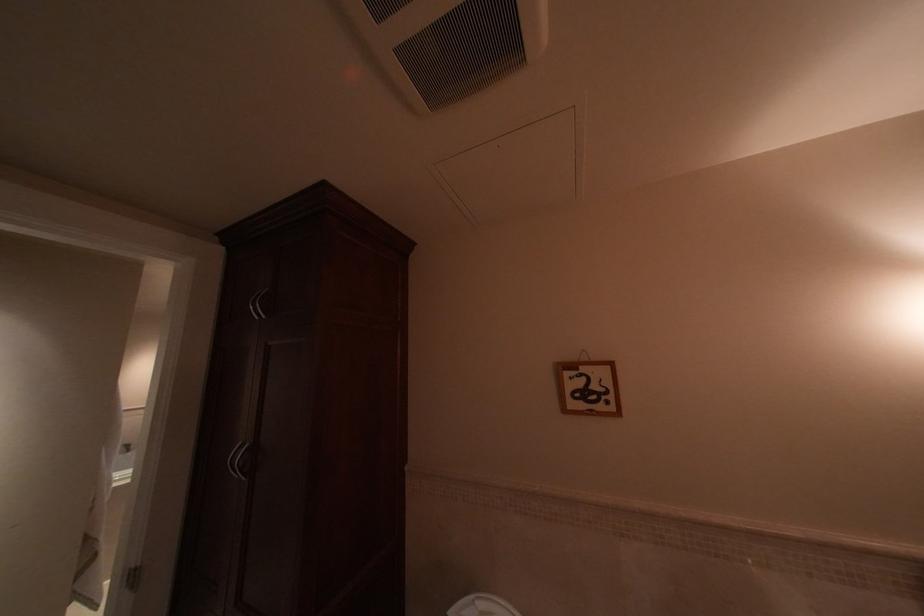
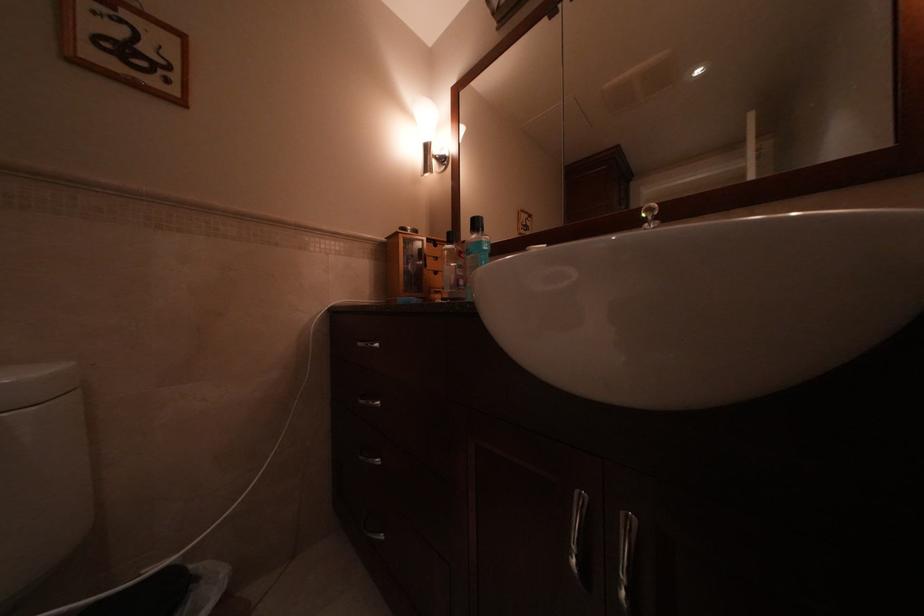
Question: The camera is either moving clockwise (left) or counter-clockwise (right) around the object. The first image is from the beginning of the video and the second image is from the end. Is the camera moving left or right when shooting the video?

Choices:
 (A) Left
 (B) Right

Answer: (A)